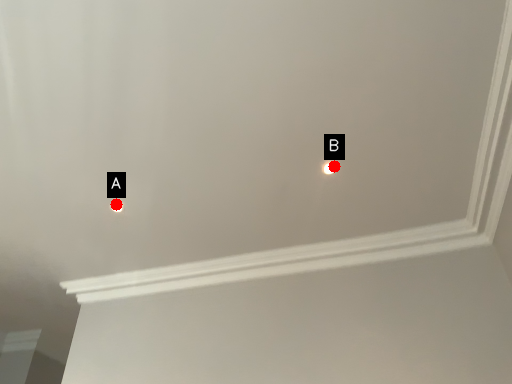
Question: Two points are circled on the image, labeled by A and B beside each circle. Which of the following is the closest to the observer?

Choices:
 (A) A is closer
 (B) B is closer

Answer: (B)